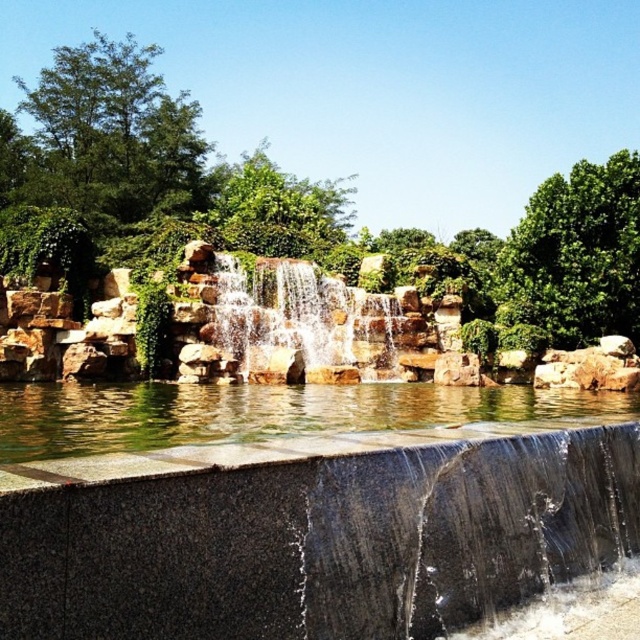
Question: Can you confirm if clear water at center is smaller than smooth stone waterfall at center?

Choices:
 (A) no
 (B) yes

Answer: (A)

Question: Among these objects, which one is farthest from the camera?

Choices:
 (A) clear water at center
 (B) smooth stone waterfall at center

Answer: (B)

Question: Considering the relative positions of clear water at center and smooth stone waterfall at center in the image provided, where is clear water at center located with respect to smooth stone waterfall at center?

Choices:
 (A) left
 (B) right

Answer: (B)

Question: Is clear water at center positioned before smooth stone waterfall at center?

Choices:
 (A) no
 (B) yes

Answer: (B)